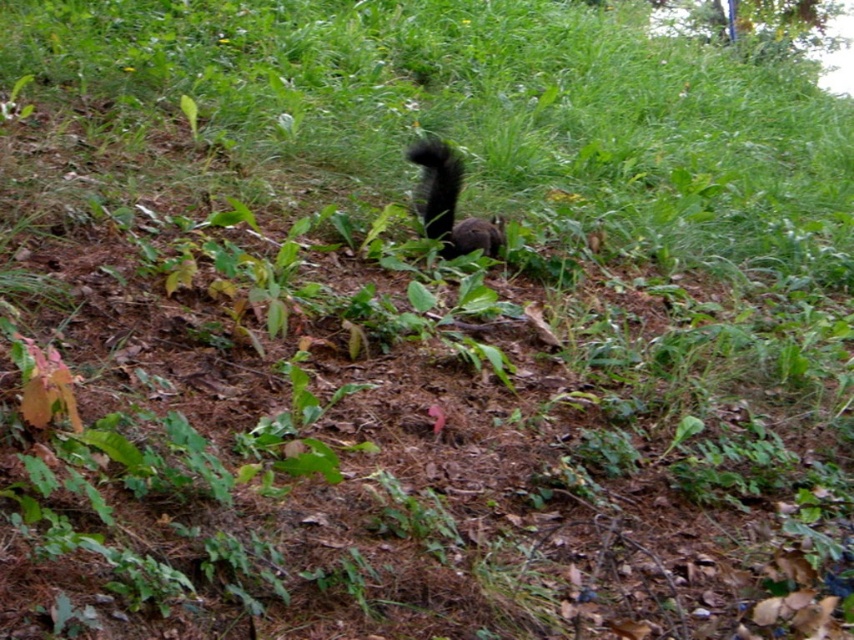
Question: Which object is closer to the camera taking this photo?

Choices:
 (A) black furry squirrel at center
 (B) black fuzzy tail at center

Answer: (A)

Question: Which point is closer to the camera?

Choices:
 (A) (446, 220)
 (B) (439, 180)

Answer: (B)

Question: Can you confirm if black furry squirrel at center is wider than black fuzzy tail at center?

Choices:
 (A) yes
 (B) no

Answer: (A)

Question: Can you confirm if black furry squirrel at center is positioned below black fuzzy tail at center?

Choices:
 (A) no
 (B) yes

Answer: (A)

Question: Can you confirm if black furry squirrel at center is bigger than black fuzzy tail at center?

Choices:
 (A) no
 (B) yes

Answer: (B)